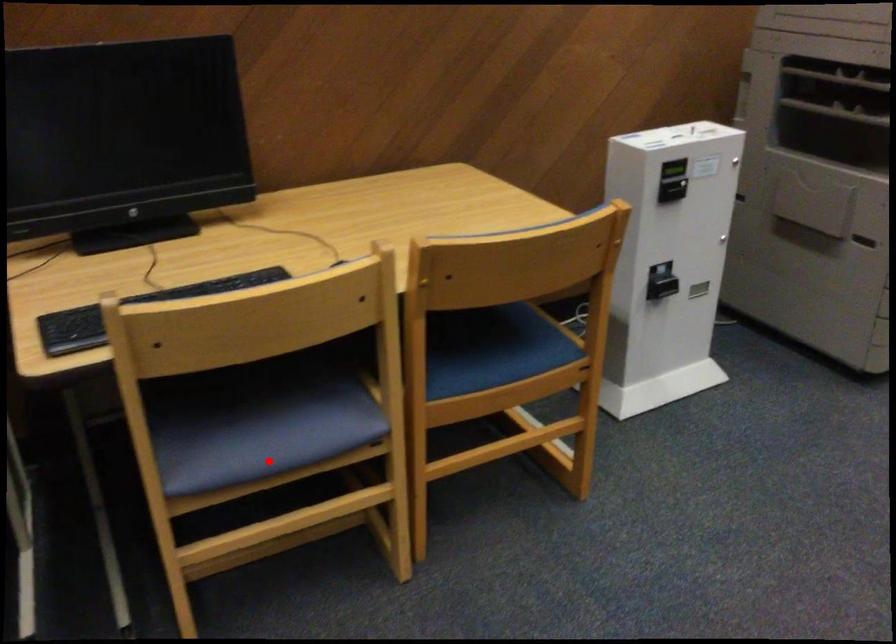
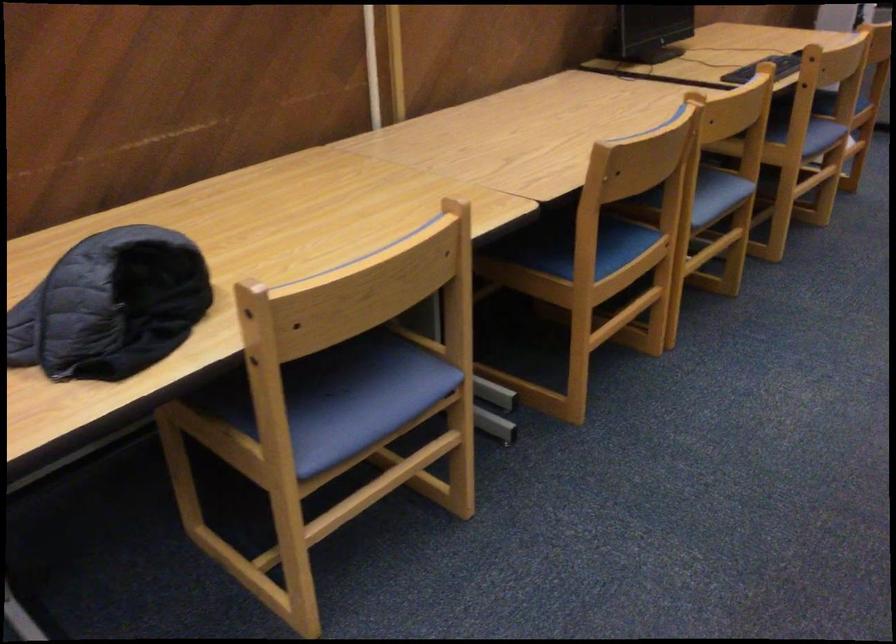
Question: A red point is marked in image1. In image2, is the corresponding 3D point closer to the camera or farther? Reply with the corresponding letter.

Choices:
 (A) The corresponding 3D point is closer.
 (B) The corresponding 3D point is farther.

Answer: (B)